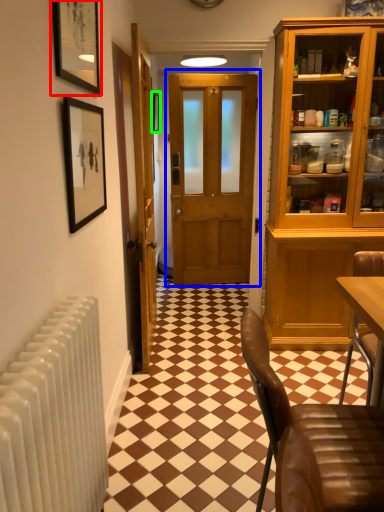
Question: Based on their relative distances, which object is nearer to picture frame (highlighted by a red box)? Choose from door (highlighted by a blue box) and picture frame (highlighted by a green box).

Choices:
 (A) door
 (B) picture frame

Answer: (A)